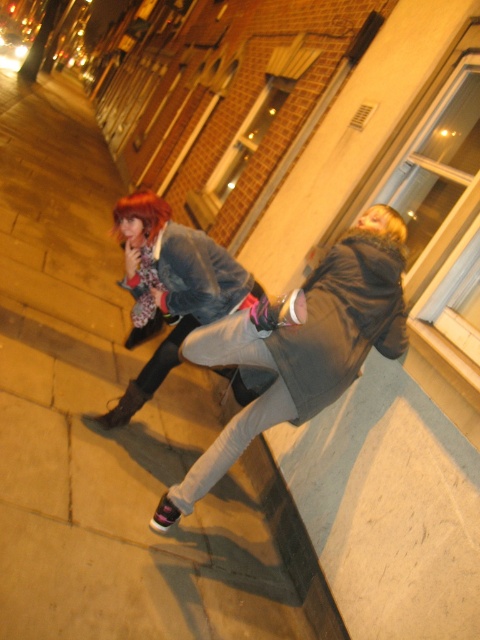
You are a photographer standing at the base of the building looking up at the ledge where the two people are sitting. You want to capture a photo that includes both the concrete at lower left and the matte black jacket at upper left. Based on their relative heights, which object will appear larger in the photo?

The concrete at lower left is much taller than the matte black jacket at upper left. Since the concrete is closer to the camera and occupies more vertical space, it will appear larger in the photo than the matte black jacket at upper left.

You are standing at the concrete at lower left and want to move towards the two people sitting on the ledge. Which direction should you go to reach them?

The concrete at lower left is located at point (103, 428), so you should move towards the upper right direction to reach the two people sitting on the ledge.

You are standing at the origin point of the image coordinate system. The origin is at the bottom left corner of the image. The x and y axes increase to the right and upwards respectively. There is a point marked at coordinate point (170, 289). What object is located at this point?

The point at coordinate point (170, 289) marks the location of the matte black jacket at upper left.